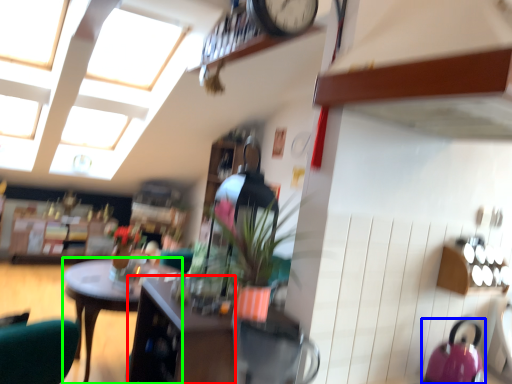
Question: Estimate the real-world distances between objects in this image. Which object is farther from cabinetry (highlighted by a red box), kettle (highlighted by a blue box) or desk (highlighted by a green box)?

Choices:
 (A) kettle
 (B) desk

Answer: (B)